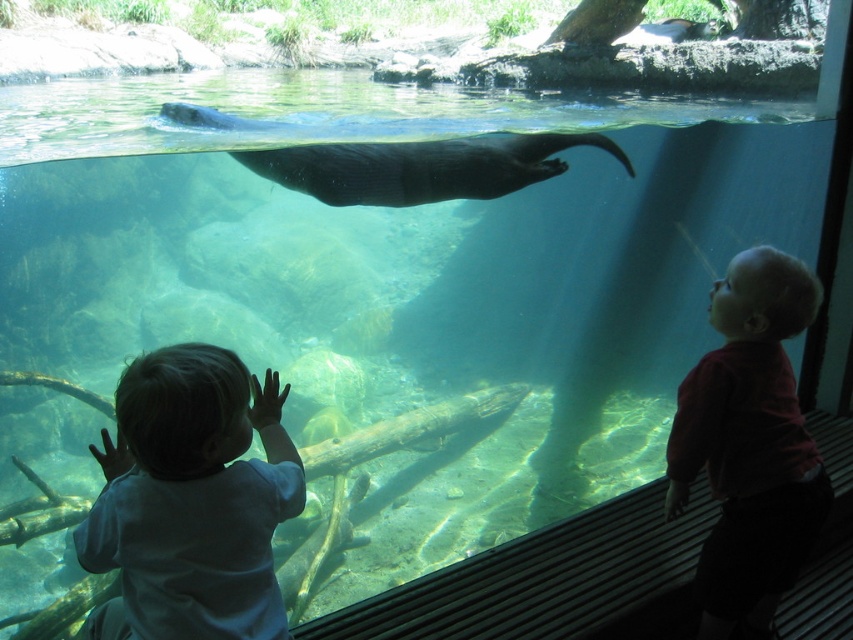
You are a zookeeper trying to place a new feeding station in the tank. The feeding station must be placed between the two points marked as point (219, 376) and point (428, 192). Which point should the feeding station be closer to if it needs to be positioned in front of the second point?

The feeding station should be placed closer to point (219, 376) because it is in front of point (428, 192).

You are a zookeeper who needs to locate the child wearing the light blue shirt at left. According to the coordinates provided, where exactly should you look in the image?

The light blue shirt at left is located at point 0.781 on the x axis and 0.225 on the y axis.

You are a zookeeper who needs to ensure the children are positioned safely. According to the image, which child is closer to the tank, the light blue shirt at left or the smooth red shirt at right?

The light blue shirt at left is closer to the tank because they are positioned in front of the smooth red shirt at right.